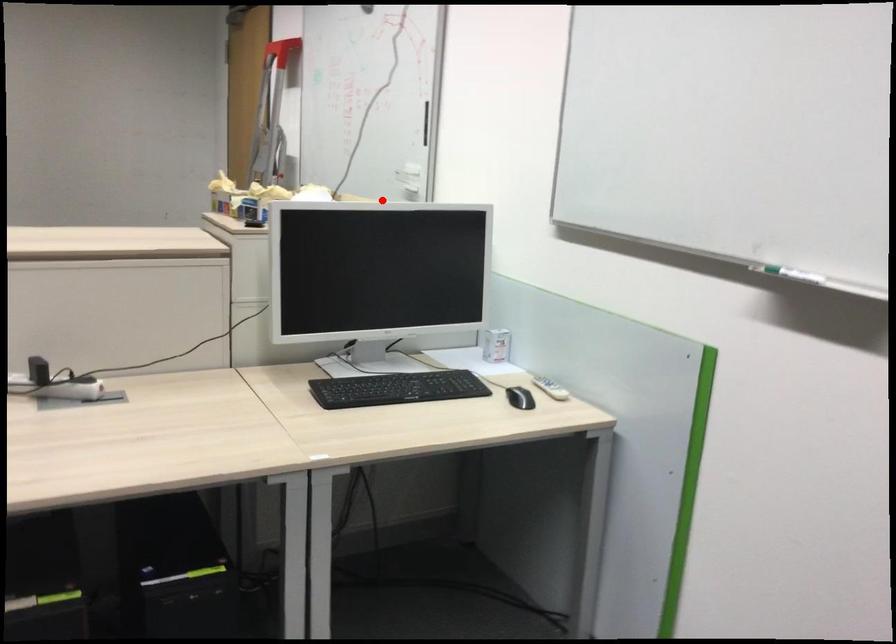
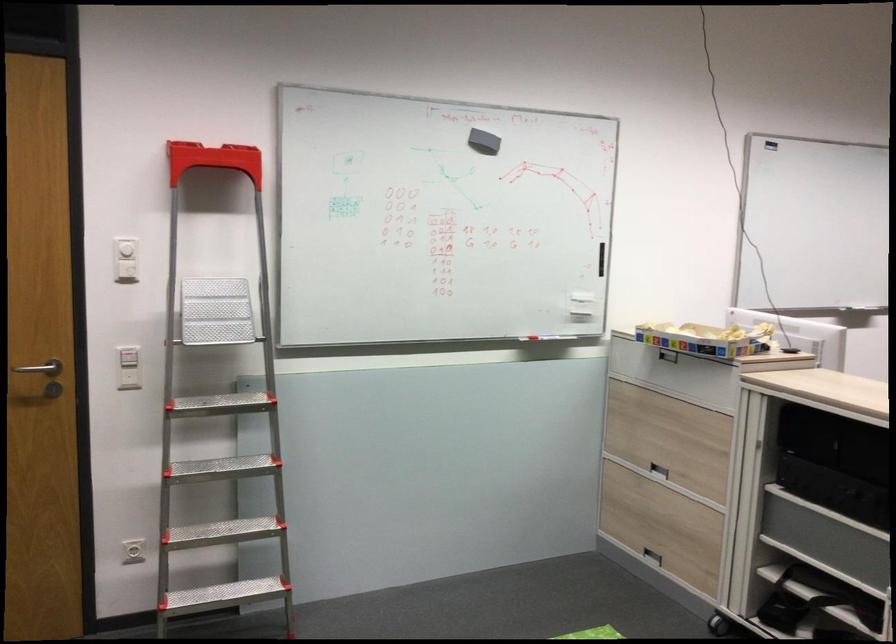
Locate, in the second image, the point that corresponds to the highlighted location in the first image.

(539, 337)